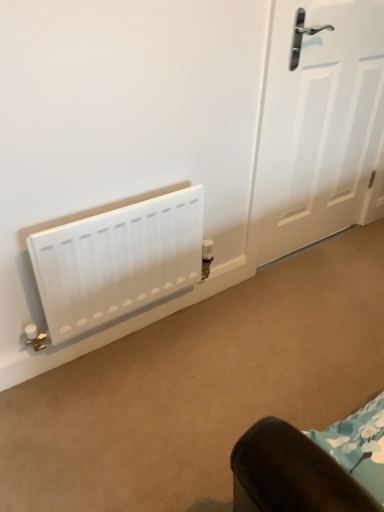
Question: From a real-world perspective, is white matte door at right physically below white matte radiator at lower left?

Choices:
 (A) no
 (B) yes

Answer: (A)

Question: Considering the relative sizes of white matte door at right and white matte radiator at lower left in the image provided, is white matte door at right wider than white matte radiator at lower left?

Choices:
 (A) no
 (B) yes

Answer: (A)

Question: Can you confirm if white matte door at right is positioned to the left of white matte radiator at lower left?

Choices:
 (A) no
 (B) yes

Answer: (A)

Question: Can you confirm if white matte door at right is shorter than white matte radiator at lower left?

Choices:
 (A) yes
 (B) no

Answer: (B)

Question: Does white matte door at right turn towards white matte radiator at lower left?

Choices:
 (A) no
 (B) yes

Answer: (A)

Question: Is white matte door at right not inside white matte radiator at lower left?

Choices:
 (A) yes
 (B) no

Answer: (A)

Question: Is white matte radiator at lower left placed right next to white matte door at right?

Choices:
 (A) yes
 (B) no

Answer: (B)

Question: Is white matte radiator at lower left not within white matte door at right?

Choices:
 (A) no
 (B) yes

Answer: (B)

Question: Does white matte radiator at lower left lie behind white matte door at right?

Choices:
 (A) yes
 (B) no

Answer: (B)

Question: Does white matte radiator at lower left have a greater height compared to white matte door at right?

Choices:
 (A) no
 (B) yes

Answer: (A)

Question: Does white matte radiator at lower left have a smaller size compared to white matte door at right?

Choices:
 (A) no
 (B) yes

Answer: (B)

Question: Is white matte door at right at the back of white matte radiator at lower left?

Choices:
 (A) no
 (B) yes

Answer: (A)

Question: From the image's perspective, is white matte radiator at lower left above or below white matte door at right?

Choices:
 (A) below
 (B) above

Answer: (A)